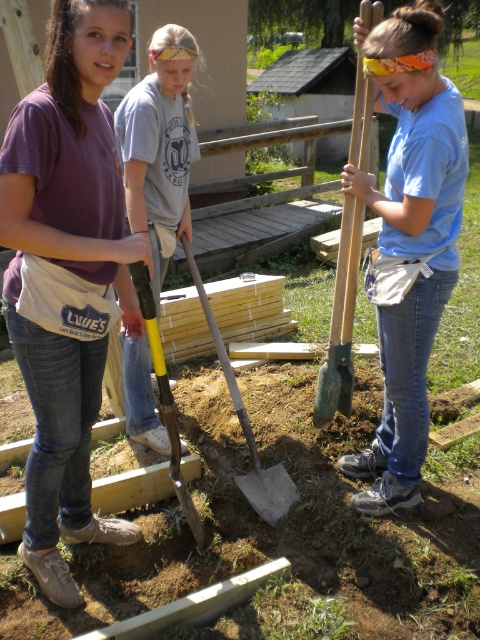
You are a GUI agent. You are given a task and a screenshot of the screen. Output one action in this format:
    pyautogui.click(x=<x>, y=<y>)
    Task: Click on the matte purple shirt at upper left
    
    Given the screenshot: What is the action you would take?
    pyautogui.click(x=68, y=269)

Which is in front, point (67, 422) or point (247, 483)?

Point (67, 422) is more forward.

In order to click on matte purple shirt at upper left in this screenshot , I will do `click(68, 269)`.

In order to click on matte purple shirt at upper left in this screenshot , I will do (x=68, y=269).

Can you confirm if matte purple shirt at upper left is positioned to the right of blue matte shirt at center?

No, matte purple shirt at upper left is not to the right of blue matte shirt at center.

Which is more to the left, matte purple shirt at upper left or blue matte shirt at center?

matte purple shirt at upper left is more to the left.

Looking at this image, who is more distant from viewer, [100,234] or [383,54]?

Point [383,54]

This screenshot has width=480, height=640. I want to click on matte purple shirt at upper left, so click(68, 269).

Is the position of green wood shovel at center less distant than that of yellow handle shovel at center?

No.

The width and height of the screenshot is (480, 640). What do you see at coordinates (340, 321) in the screenshot? I see `green wood shovel at center` at bounding box center [340, 321].

This screenshot has width=480, height=640. In order to click on green wood shovel at center in this screenshot , I will do `click(340, 321)`.